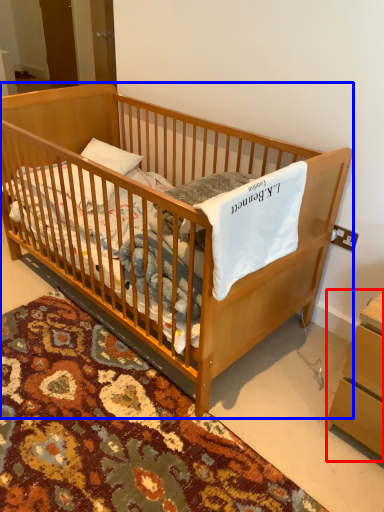
Question: Among these objects, which one is farthest to the camera, changing table (highlighted by a red box) or infant bed (highlighted by a blue box)?

Choices:
 (A) changing table
 (B) infant bed

Answer: (A)